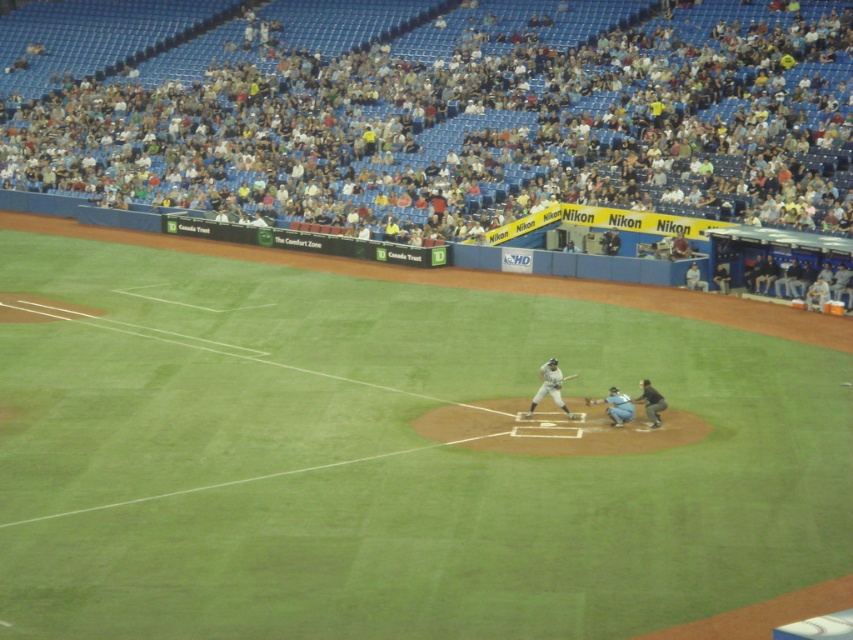
You are a spectator trying to locate the dark gray uniform at home plate and the wooden baseball bat at center during the baseball game. Which object is positioned lower in the image?

The dark gray uniform at home plate is positioned below the wooden baseball bat at center, so it is lower in the image.

You are a drone operator trying to capture footage of the baseball game. You have two points marked in the image, point 1 at coordinates point (202, 429) and point 2 at coordinates point (695, 264). Which point is closer to the drone camera?

Point (202, 429) is closer to the viewer than point (695, 264), so the drone camera would capture it first.